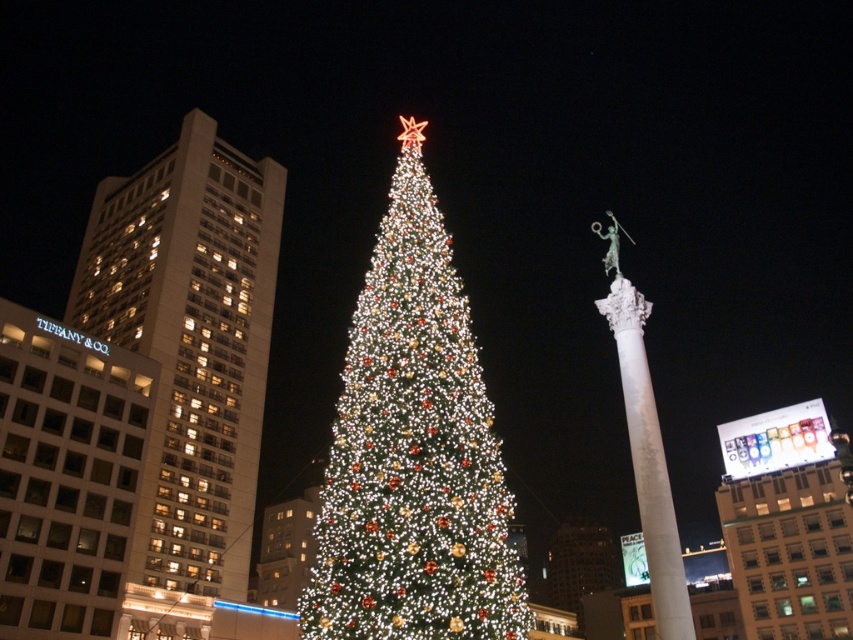
Question: Among these objects, which one is nearest to the camera?

Choices:
 (A) white marble column at center-right
 (B) illuminated green christmas tree at center

Answer: (B)

Question: Can you confirm if illuminated green christmas tree at center is thinner than white marble column at center-right?

Choices:
 (A) yes
 (B) no

Answer: (B)

Question: Is illuminated green christmas tree at center positioned before white marble column at center-right?

Choices:
 (A) no
 (B) yes

Answer: (B)

Question: Which point appears closest to the camera in this image?

Choices:
 (A) tap(689, 605)
 (B) tap(439, 476)

Answer: (B)

Question: Does illuminated green christmas tree at center have a greater width compared to white marble column at center-right?

Choices:
 (A) no
 (B) yes

Answer: (B)